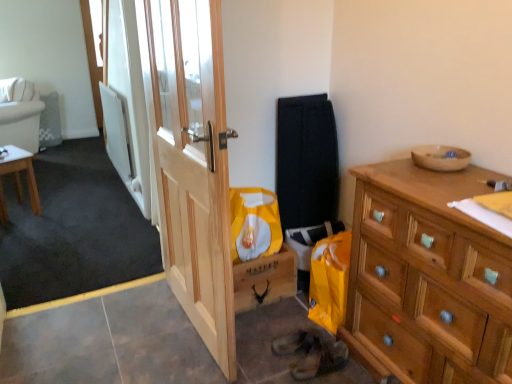
Question: Is light brown wooden table at left taller or shorter than leather shoe at lower center?

Choices:
 (A) tall
 (B) short

Answer: (A)

Question: Is light brown wooden table at left inside the boundaries of leather shoe at lower center, or outside?

Choices:
 (A) outside
 (B) inside

Answer: (A)

Question: Which object is positioned farthest from the white fabric pillow at upper left?

Choices:
 (A) natural wood door at center
 (B) light brown wooden table at left
 (C) white fabric couch at upper left
 (D) wooden dresser at right
 (E) leather shoe at lower center

Answer: (D)

Question: Estimate the real-world distances between objects in this image. Which object is farther from the white fabric pillow at upper left?

Choices:
 (A) wooden bowl at upper right
 (B) leather shoe at lower center
 (C) wooden dresser at right
 (D) natural wood door at center
 (E) white fabric couch at upper left

Answer: (C)